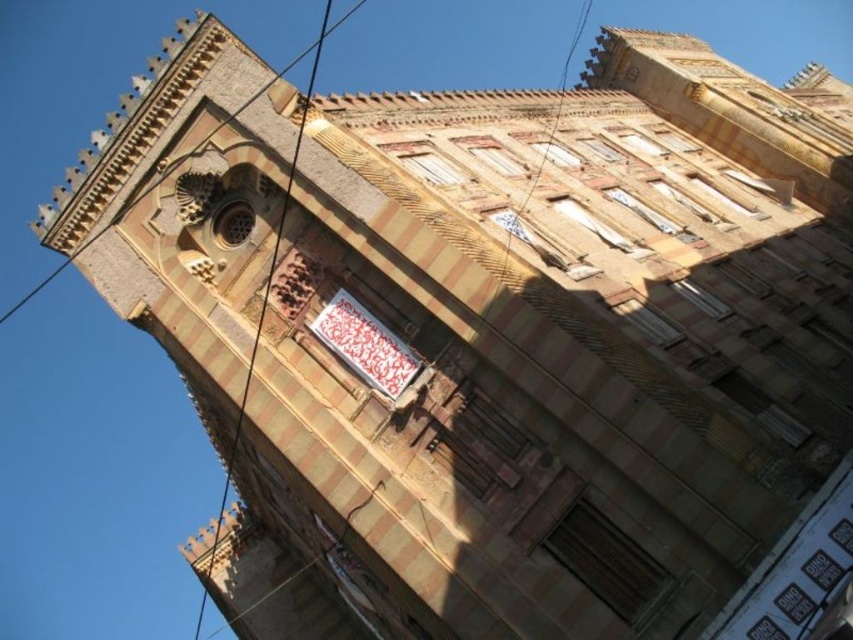
Question: Does white fabric sign at center appear over metallic wire at upper left?

Choices:
 (A) yes
 (B) no

Answer: (B)

Question: Which object appears farthest from the camera in this image?

Choices:
 (A) metallic wire at upper left
 (B) white fabric sign at center

Answer: (A)

Question: Is white fabric sign at center bigger than metallic wire at upper left?

Choices:
 (A) yes
 (B) no

Answer: (B)

Question: Which object appears farthest from the camera in this image?

Choices:
 (A) metallic wire at upper left
 (B) white fabric sign at center

Answer: (A)

Question: Can you confirm if white fabric sign at center is positioned to the right of metallic wire at upper left?

Choices:
 (A) yes
 (B) no

Answer: (A)